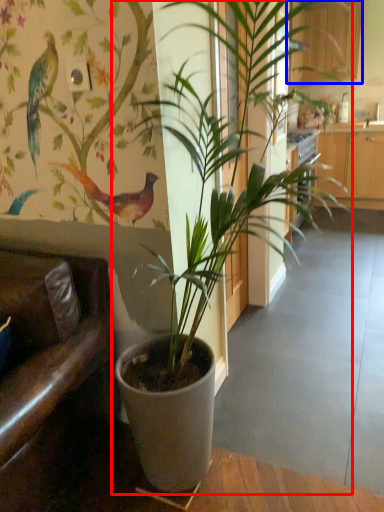
Question: Among these objects, which one is nearest to the camera, houseplant (highlighted by a red box) or furniture (highlighted by a blue box)?

Choices:
 (A) houseplant
 (B) furniture

Answer: (A)